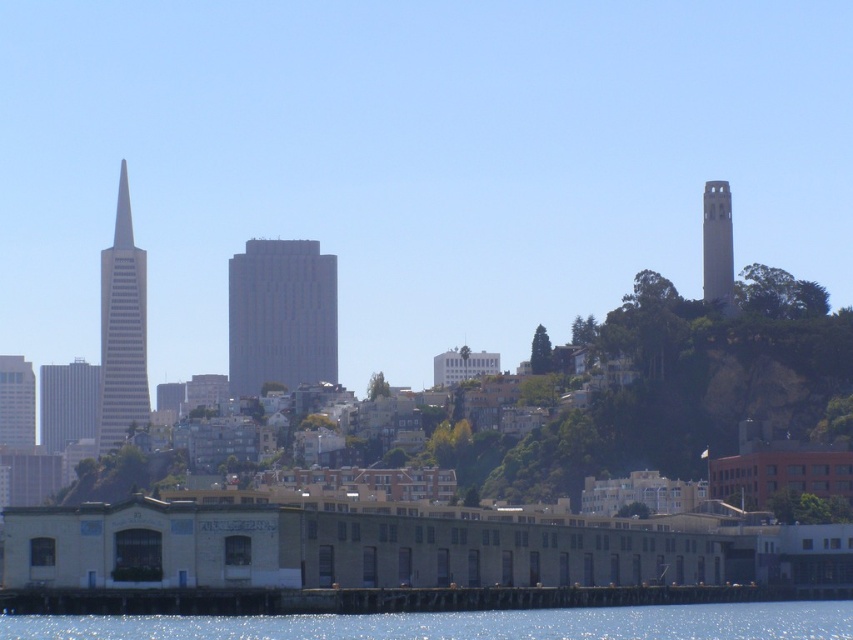
Can you confirm if gray glass skyscraper at center-left is wider than matte gray skyscraper at left?

Yes.

Who is more forward, (84,376) or (15,410)?

Point (84,376) is in front.

Find the location of a particular element. gray glass skyscraper at center-left is located at coordinates (67, 403).

Can you confirm if gray glass skyscraper at left is shorter than smooth concrete tower at upper right?

No, gray glass skyscraper at left is not shorter than smooth concrete tower at upper right.

Does gray glass skyscraper at left appear over smooth concrete tower at upper right?

No.

Does point (113, 444) lie behind point (722, 280)?

Yes, point (113, 444) is behind point (722, 280).

Where is `gray glass skyscraper at left`? The image size is (853, 640). gray glass skyscraper at left is located at coordinates (122, 330).

How far apart are gray concrete building at center and smooth concrete tower at upper right?

116.82 meters

Who is more forward, (265, 317) or (703, 228)?

Point (265, 317) is more forward.

Locate an element on the screen. Image resolution: width=853 pixels, height=640 pixels. gray concrete building at center is located at coordinates (281, 316).